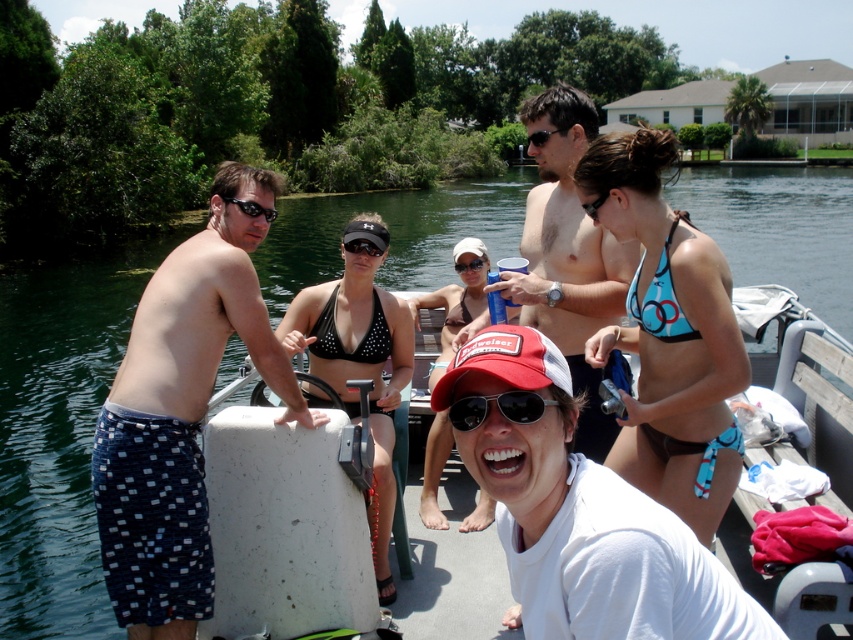
You are on a boat with two pairs of goggles. The black textured goggles at center and the black rubber goggles at center. Which one is positioned to the left?

The black textured goggles at center are positioned to the left of the black rubber goggles at center.

You are a swimmer preparing to jump into the water. You see two pairs of goggles at the center of the boat deck. Which pair of goggles is positioned lower on the deck? The black textured goggles at center or the black rubber goggles at center?

The black textured goggles at center is located below the black rubber goggles at center, so the black textured goggles at center is positioned lower on the deck.